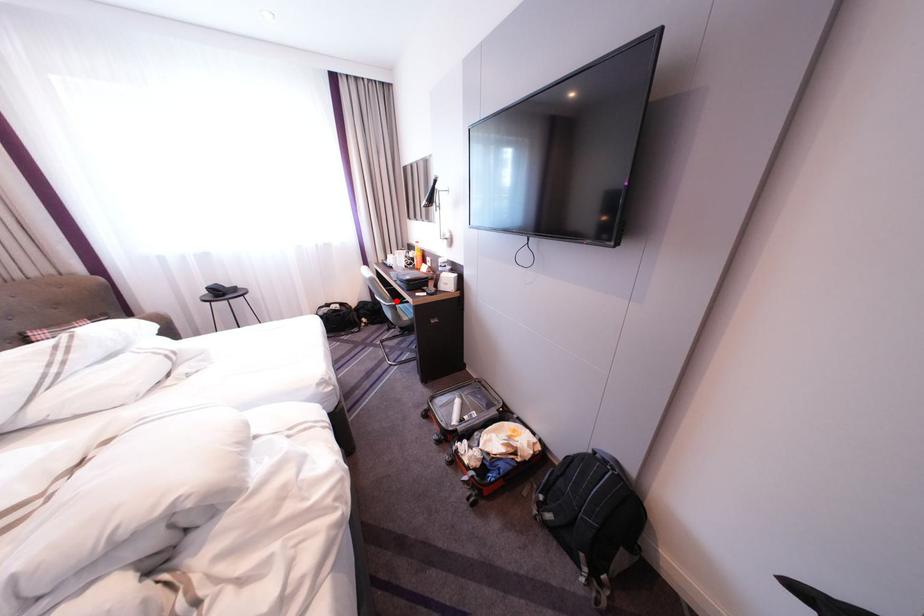
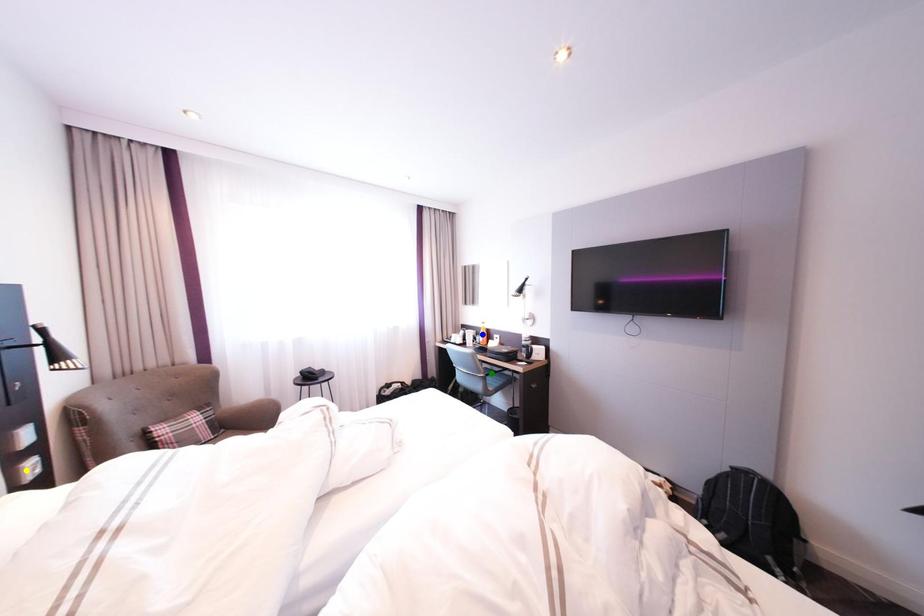
Question: I am providing you with two images of the same scene from different viewpoints. A red point is marked on the first image. You are given multiple points on the second image. Which point in image 2 represents the same 3d spot as the red point in image 1?

Choices:
 (A) blue point
 (B) green point
 (C) yellow point

Answer: (B)